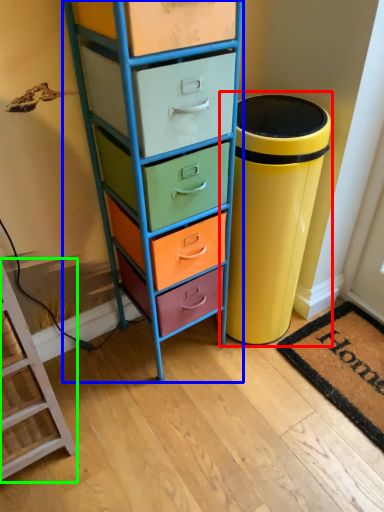
Question: Based on their relative distances, which object is farther from waste container (highlighted by a red box)? Choose from chest of drawers (highlighted by a blue box) and furniture (highlighted by a green box).

Choices:
 (A) chest of drawers
 (B) furniture

Answer: (B)